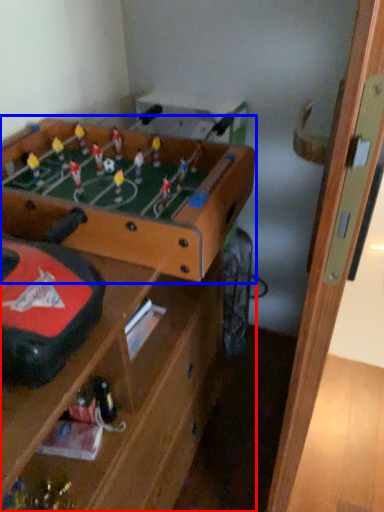
Question: Which object appears closest to the camera in this image, table (highlighted by a red box) or table (highlighted by a blue box)?

Choices:
 (A) table
 (B) table

Answer: (A)